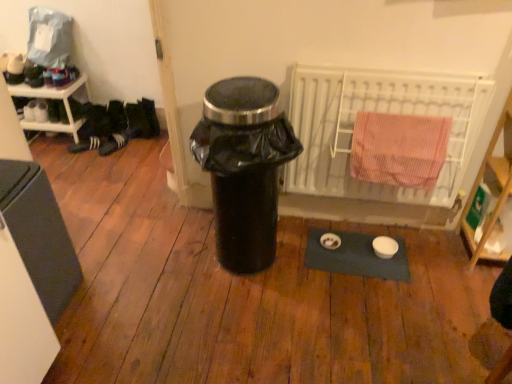
In order to click on free space between wooden shelf at right, the 2th shelf viewed from the back, and matte gray refrigerator at left in this screenshot , I will do `click(257, 276)`.